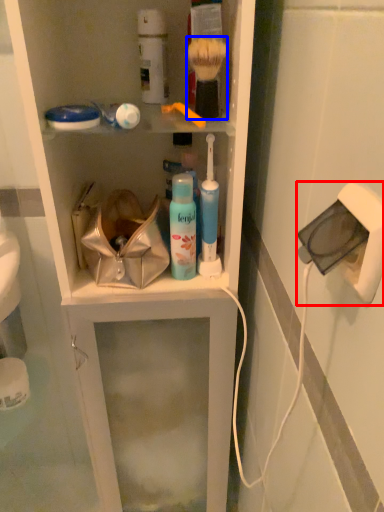
Question: Among these objects, which one is nearest to the camera, electric outlet (highlighted by a red box) or brush (highlighted by a blue box)?

Choices:
 (A) electric outlet
 (B) brush

Answer: (A)